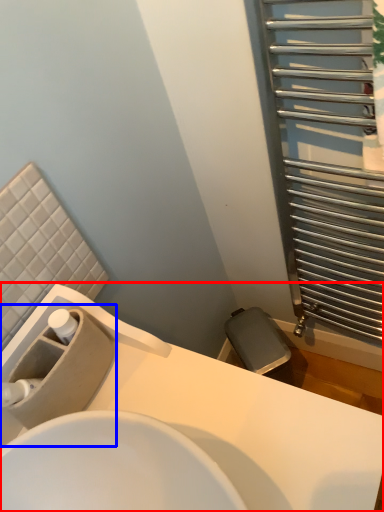
Question: Which object is further to the camera taking this photo, sink (highlighted by a red box) or sink (highlighted by a blue box)?

Choices:
 (A) sink
 (B) sink

Answer: (B)